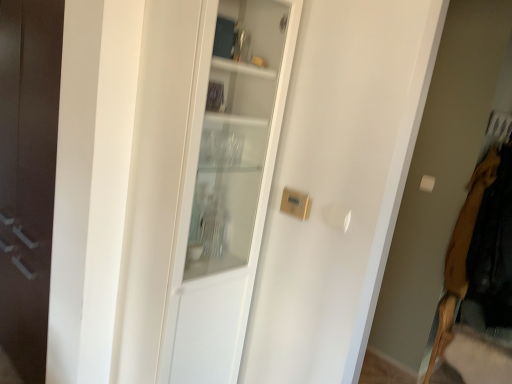
Question: From a real-world perspective, is velvet brown coat at right physically located above or below white glass cabinet at center?

Choices:
 (A) above
 (B) below

Answer: (B)

Question: In terms of height, does velvet brown coat at right look taller or shorter compared to white glass cabinet at center?

Choices:
 (A) tall
 (B) short

Answer: (B)

Question: Is velvet brown coat at right situated inside white glass cabinet at center or outside?

Choices:
 (A) inside
 (B) outside

Answer: (B)

Question: From a real-world perspective, relative to velvet brown coat at right, is white glass cabinet at center vertically above or below?

Choices:
 (A) below
 (B) above

Answer: (B)

Question: From the image's perspective, is white glass cabinet at center located above or below velvet brown coat at right?

Choices:
 (A) above
 (B) below

Answer: (A)

Question: Is white glass cabinet at center spatially inside velvet brown coat at right, or outside of it?

Choices:
 (A) outside
 (B) inside

Answer: (A)

Question: Would you say white glass cabinet at center is to the left or to the right of velvet brown coat at right in the picture?

Choices:
 (A) left
 (B) right

Answer: (A)